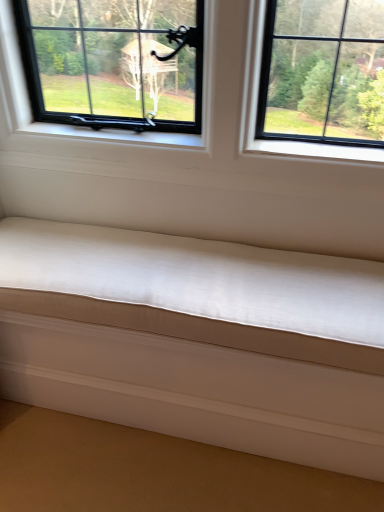
In order to face white fabric cushion at center, should I rotate leftwards or rightwards?

It's best to rotate left around 0.640 degrees.

Measure the distance between white fabric cushion at center and camera.

The distance of white fabric cushion at center from camera is 38.25 inches.

This screenshot has width=384, height=512. In order to click on white fabric cushion at center in this screenshot , I will do `click(198, 340)`.

This screenshot has width=384, height=512. Describe the element at coordinates (198, 340) in the screenshot. I see `white fabric cushion at center` at that location.

The image size is (384, 512). I want to click on white fabric cushion at center, so click(198, 340).